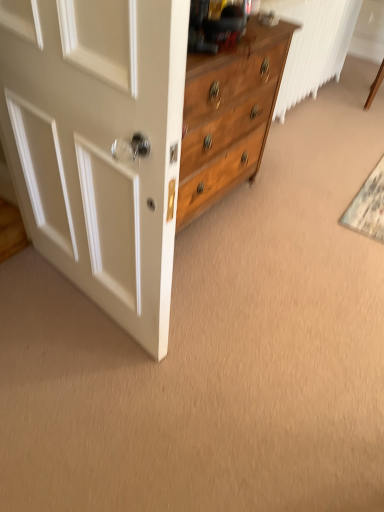
Describe the element at coordinates (99, 145) in the screenshot. The height and width of the screenshot is (512, 384). I see `white glossy door at left` at that location.

Find the location of a particular element. white glossy door at left is located at coordinates (99, 145).

Image resolution: width=384 pixels, height=512 pixels. What do you see at coordinates (368, 206) in the screenshot?
I see `textured gray doormat at lower right` at bounding box center [368, 206].

Identify the location of textured gray doormat at lower right. (368, 206).

Where is `white glossy door at left`? The width and height of the screenshot is (384, 512). white glossy door at left is located at coordinates (99, 145).

Between textured gray doormat at lower right and white glossy door at left, which one appears on the right side from the viewer's perspective?

From the viewer's perspective, textured gray doormat at lower right appears more on the right side.

Is the depth of textured gray doormat at lower right greater than that of white glossy door at left?

Yes, textured gray doormat at lower right is further from the viewer.

Is point (378, 194) farther from camera compared to point (13, 31)?

Yes, it is behind point (13, 31).

From the image's perspective, who appears lower, textured gray doormat at lower right or white glossy door at left?

white glossy door at left.

From a real-world perspective, who is located higher, textured gray doormat at lower right or white glossy door at left?

white glossy door at left.

Considering the sizes of textured gray doormat at lower right and white glossy door at left in the image, is textured gray doormat at lower right wider or thinner than white glossy door at left?

In the image, textured gray doormat at lower right appears to be wider than white glossy door at left.

Which of these two, textured gray doormat at lower right or white glossy door at left, stands shorter?

Standing shorter between the two is textured gray doormat at lower right.

Can you confirm if textured gray doormat at lower right is bigger than white glossy door at left?

No, textured gray doormat at lower right is not bigger than white glossy door at left.

Is textured gray doormat at lower right located outside white glossy door at left?

Yes, textured gray doormat at lower right is not within white glossy door at left.

Is textured gray doormat at lower right not close to white glossy door at left?

Absolutely, textured gray doormat at lower right is distant from white glossy door at left.

Does textured gray doormat at lower right turn towards white glossy door at left?

No.

How different are the orientations of textured gray doormat at lower right and white glossy door at left in degrees?

7.88 degrees.

Measure the distance from textured gray doormat at lower right to white glossy door at left.

textured gray doormat at lower right is 4.81 feet from white glossy door at left.

Identify the location of doormat that is on the right side of white glossy door at left. (368, 206).

Which object is positioned more to the left, white glossy door at left or textured gray doormat at lower right?

white glossy door at left is more to the left.

Is white glossy door at left behind textured gray doormat at lower right?

No, white glossy door at left is closer to the camera.

Is point (3, 30) less distant than point (367, 197)?

Yes, point (3, 30) is in front of point (367, 197).

From the image's perspective, is white glossy door at left below textured gray doormat at lower right?

Yes, from the image's perspective, white glossy door at left is beneath textured gray doormat at lower right.

From a real-world perspective, which object stands above the other?

white glossy door at left is physically above.

Which object is wider, white glossy door at left or textured gray doormat at lower right?

textured gray doormat at lower right.

Does white glossy door at left have a greater height compared to textured gray doormat at lower right?

Yes.

Considering the sizes of objects white glossy door at left and textured gray doormat at lower right in the image provided, who is bigger, white glossy door at left or textured gray doormat at lower right?

Bigger between the two is white glossy door at left.

Is white glossy door at left inside or outside of textured gray doormat at lower right?

white glossy door at left is located beyond the bounds of textured gray doormat at lower right.

Would you consider white glossy door at left to be distant from textured gray doormat at lower right?

Yes, white glossy door at left is far from textured gray doormat at lower right.

Is white glossy door at left oriented towards textured gray doormat at lower right?

No, white glossy door at left is not turned towards textured gray doormat at lower right.

Measure the distance from white glossy door at left to textured gray doormat at lower right.

white glossy door at left and textured gray doormat at lower right are 4.81 feet apart.

You are a GUI agent. You are given a task and a screenshot of the screen. Output one action in this format:
    pyautogui.click(x=<x>, y=<y>)
    Task: Click on the door that appears in front of the textured gray doormat at lower right
    Image resolution: width=384 pixels, height=512 pixels.
    Given the screenshot: What is the action you would take?
    pyautogui.click(x=99, y=145)

This screenshot has width=384, height=512. Find the location of `door that appears below the textured gray doormat at lower right (from the image's perspective)`. door that appears below the textured gray doormat at lower right (from the image's perspective) is located at coordinates (99, 145).

I want to click on doormat below the white glossy door at left (from a real-world perspective), so click(368, 206).